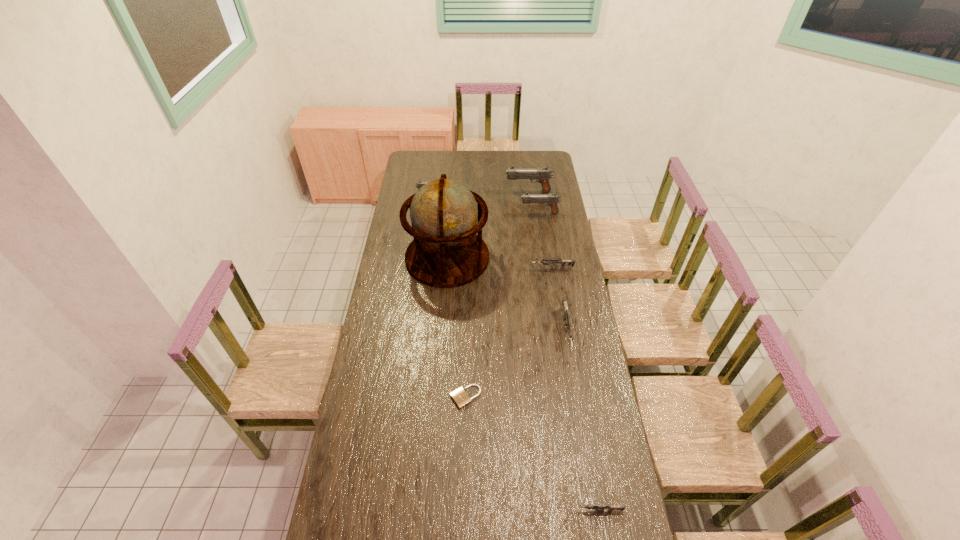
Find the location of a particular element. The height and width of the screenshot is (540, 960). the tallest object is located at coordinates (446, 252).

In order to click on the tallest gun in this screenshot , I will do click(543, 175).

The image size is (960, 540). Identify the location of the farthest object. (543, 175).

Locate an element on the screen. Image resolution: width=960 pixels, height=540 pixels. the fourth nearest gun is located at coordinates (552, 200).

Where is `the nearest gray gun`? The height and width of the screenshot is (540, 960). the nearest gray gun is located at coordinates 552,200.

Image resolution: width=960 pixels, height=540 pixels. I want to click on the fifth shortest object, so click(420, 183).

Find the location of a particular element. The image size is (960, 540). the seventh nearest object is located at coordinates (420, 183).

At what (x,y) coordinates should I click in order to perform the action: click on the second nearest gun. Please return your answer as a coordinate pair (x, y). The width and height of the screenshot is (960, 540). Looking at the image, I should click on (568, 325).

Where is `the biggest grey gun`? The width and height of the screenshot is (960, 540). the biggest grey gun is located at coordinates (568, 325).

In order to click on the second smallest grey gun in this screenshot , I will do `click(545, 262)`.